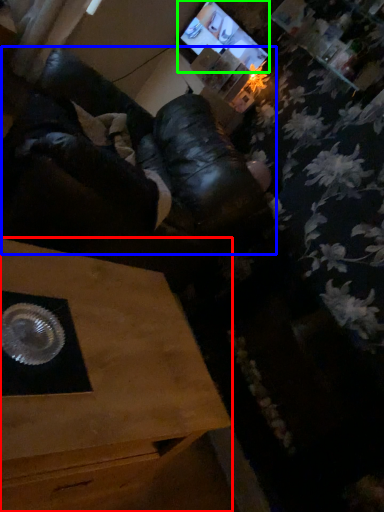
Question: Estimate the real-world distances between objects in this image. Which object is closer to table (highlighted by a red box), squat (highlighted by a blue box) or computer monitor (highlighted by a green box)?

Choices:
 (A) squat
 (B) computer monitor

Answer: (A)